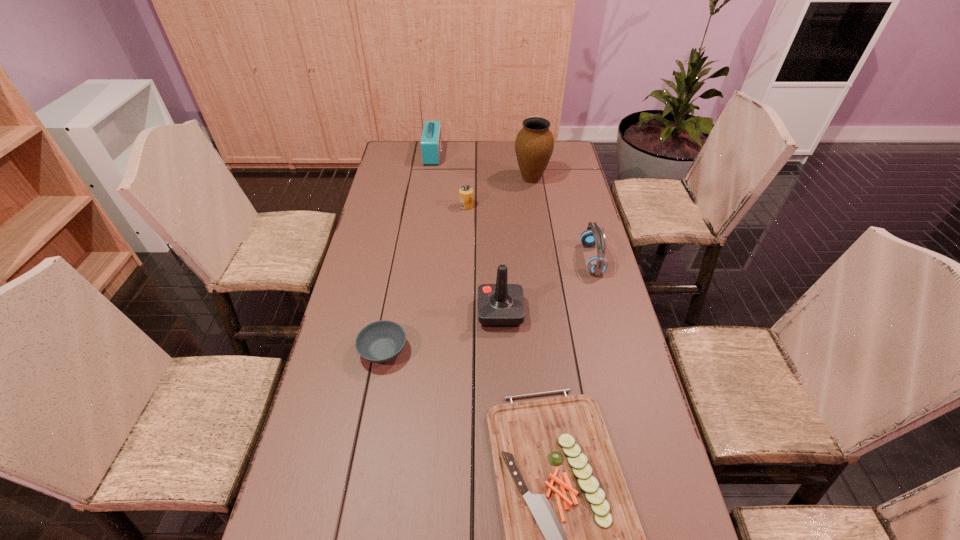
Where is `the sixth farthest object`? Image resolution: width=960 pixels, height=540 pixels. the sixth farthest object is located at coordinates (381, 341).

The height and width of the screenshot is (540, 960). I want to click on the sixth tallest object, so click(x=381, y=341).

Image resolution: width=960 pixels, height=540 pixels. Find the location of `vacant space located 0.230m on the front panel of the radio receiver`. vacant space located 0.230m on the front panel of the radio receiver is located at coordinates (493, 154).

You are a GUI agent. You are given a task and a screenshot of the screen. Output one action in this format:
    pyautogui.click(x=<x>, y=<y>)
    Task: Click on the vacant position located 0.120m on the back of the urn
    
    Given the screenshot: What is the action you would take?
    pyautogui.click(x=528, y=154)

I want to click on free location located on the back of the third tallest object, so click(497, 239).

Where is `vacant space situated 0.060m on the ear cups of the fourth nearest object`? The height and width of the screenshot is (540, 960). vacant space situated 0.060m on the ear cups of the fourth nearest object is located at coordinates (564, 259).

Find the location of a particular element. The image size is (960, 540). vacant position located on the ear cups of the fourth nearest object is located at coordinates (567, 259).

The width and height of the screenshot is (960, 540). Find the location of `blank space located on the ear cups of the fourth nearest object`. blank space located on the ear cups of the fourth nearest object is located at coordinates (524, 259).

The height and width of the screenshot is (540, 960). I want to click on vacant space located 0.160m on the front of the fifth tallest object, so click(x=466, y=237).

Where is `free spot located on the front of the sixth farthest object`? The width and height of the screenshot is (960, 540). free spot located on the front of the sixth farthest object is located at coordinates (350, 527).